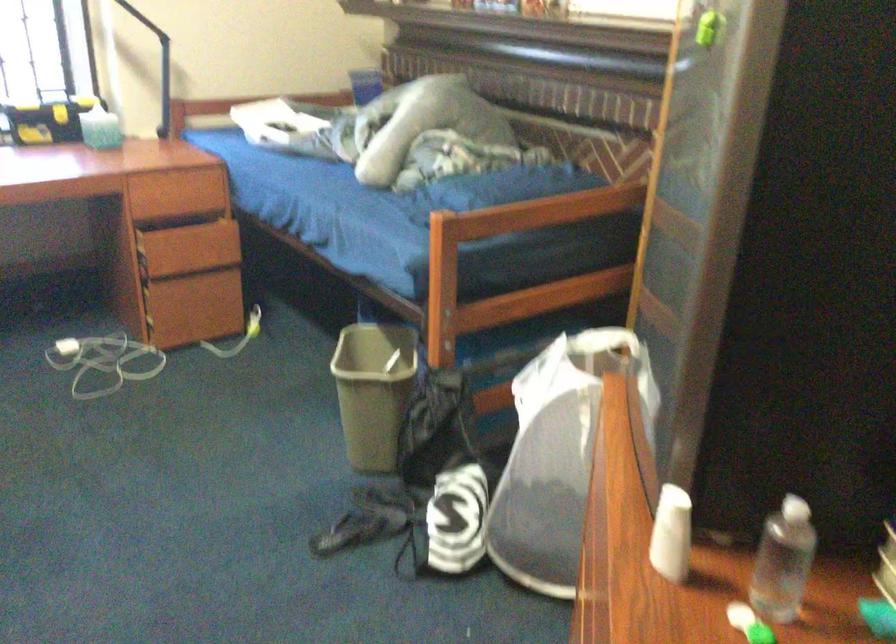
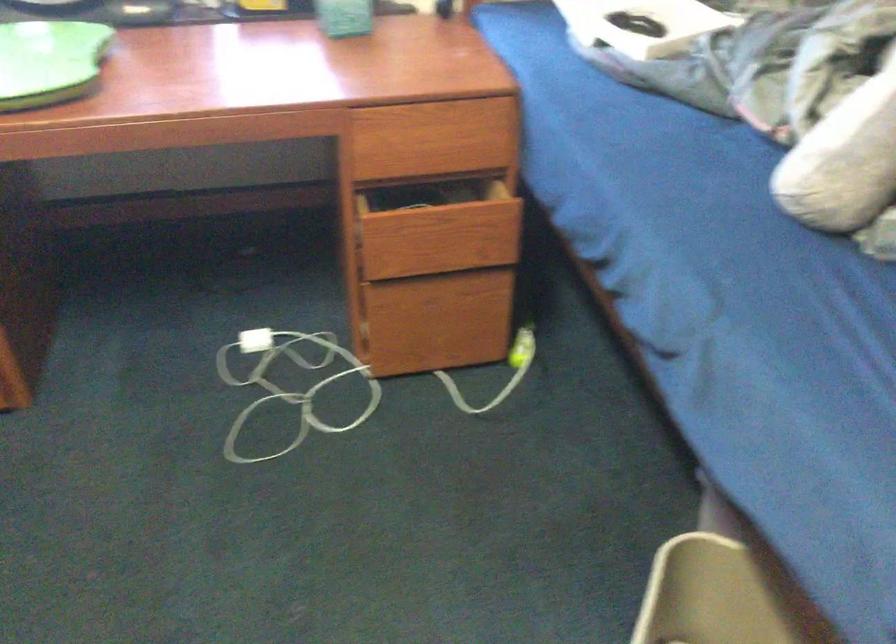
Question: Which direction would the cameraman need to move to produce the second image? Reply with the corresponding letter.

Choices:
 (A) Left
 (B) Right
 (C) Forward
 (D) Backward

Answer: (C)